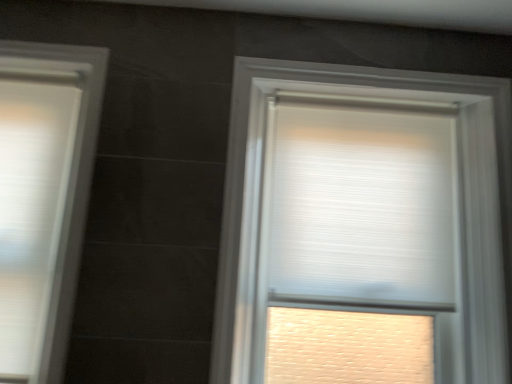
Question: Does white textured roller blind at center, arranged as the first window when viewed from the right, have a smaller size compared to white matte window at left, which is the second window in right-to-left order?

Choices:
 (A) yes
 (B) no

Answer: (B)

Question: Is white matte window at left, which is the second window in right-to-left order, at the back of white textured roller blind at center, which is the second window from left to right?

Choices:
 (A) yes
 (B) no

Answer: (B)

Question: Can white matte window at left, acting as the first window starting from the left, be found inside white textured roller blind at center, arranged as the first window when viewed from the right?

Choices:
 (A) no
 (B) yes

Answer: (A)

Question: Can you confirm if white textured roller blind at center, which is the second window from left to right, is taller than white matte window at left, which is the second window in right-to-left order?

Choices:
 (A) no
 (B) yes

Answer: (B)

Question: Is white textured roller blind at center, which is the second window from left to right, outside of white matte window at left, acting as the first window starting from the left?

Choices:
 (A) no
 (B) yes

Answer: (B)

Question: Can you confirm if white textured roller blind at center, arranged as the first window when viewed from the right, is positioned to the right of white matte window at left, acting as the first window starting from the left?

Choices:
 (A) yes
 (B) no

Answer: (A)

Question: Is white pleated blind at upper center positioned with its back to white matte window at left, which is the second window in right-to-left order?

Choices:
 (A) yes
 (B) no

Answer: (B)

Question: Can you confirm if white pleated blind at upper center is bigger than white matte window at left, acting as the first window starting from the left?

Choices:
 (A) yes
 (B) no

Answer: (A)

Question: From the image's perspective, is white pleated blind at upper center under white matte window at left, which is the second window in right-to-left order?

Choices:
 (A) no
 (B) yes

Answer: (A)

Question: Is the depth of white pleated blind at upper center less than that of white matte window at left, which is the second window in right-to-left order?

Choices:
 (A) yes
 (B) no

Answer: (B)

Question: Can white matte window at left, acting as the first window starting from the left, be found inside white pleated blind at upper center?

Choices:
 (A) yes
 (B) no

Answer: (B)

Question: Does white pleated blind at upper center have a smaller size compared to white matte window at left, acting as the first window starting from the left?

Choices:
 (A) no
 (B) yes

Answer: (A)

Question: Can you confirm if white pleated blind at upper center is bigger than white textured roller blind at center, arranged as the first window when viewed from the right?

Choices:
 (A) no
 (B) yes

Answer: (A)